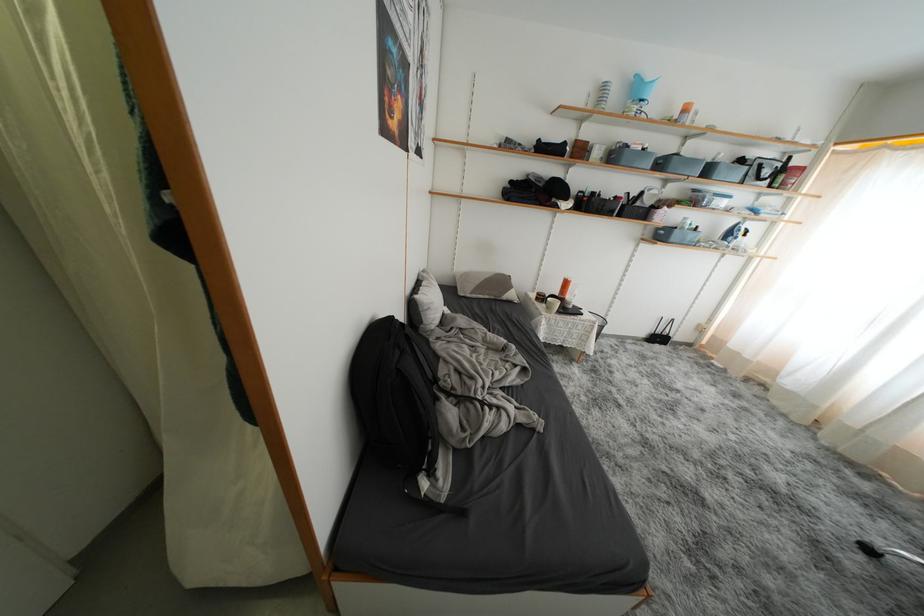
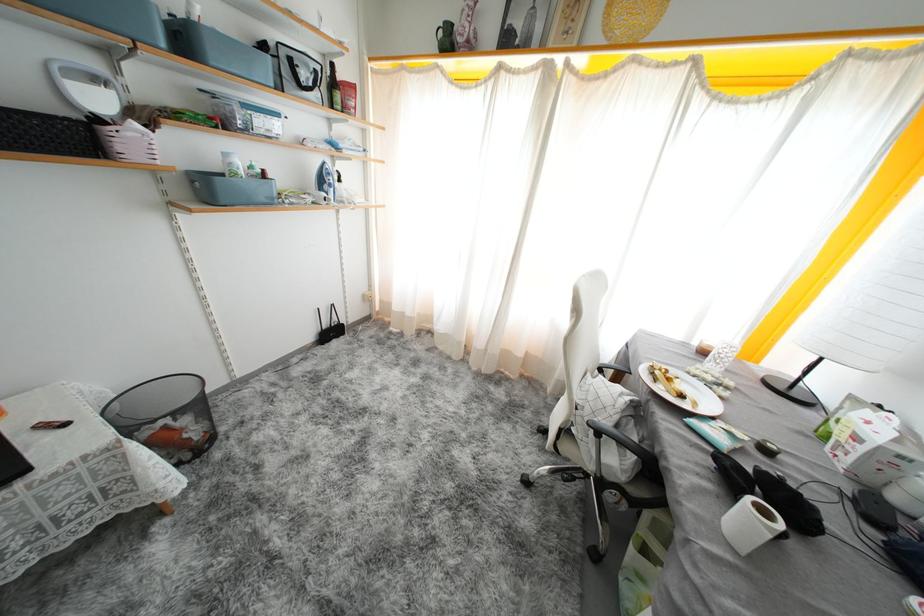
In the second image, find the point that corresponds to point 669,238 in the first image.

(215, 196)